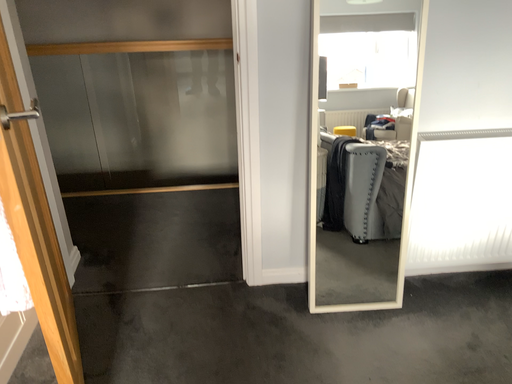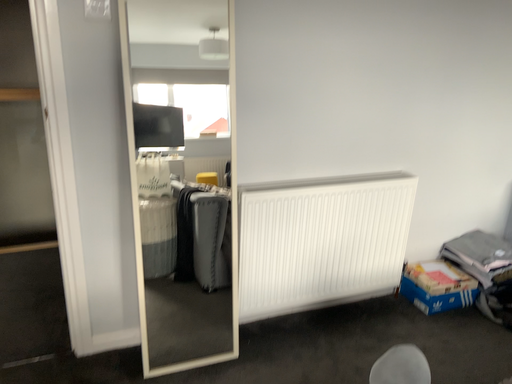
Question: Which way did the camera rotate in the video?

Choices:
 (A) rotated downward
 (B) rotated upward

Answer: (B)